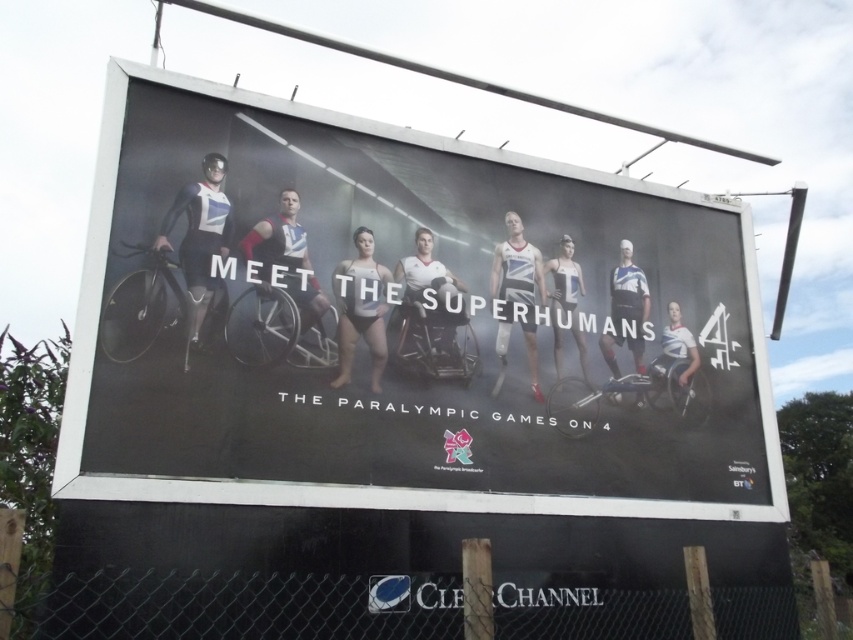
Question: Is matte black billboard at center above metal chain-link fence at lower center?

Choices:
 (A) yes
 (B) no

Answer: (A)

Question: Can you confirm if matte black billboard at center is positioned to the right of metal chain-link fence at lower center?

Choices:
 (A) no
 (B) yes

Answer: (B)

Question: Which point appears farthest from the camera in this image?

Choices:
 (A) (254, 593)
 (B) (221, 419)

Answer: (B)

Question: Does matte black billboard at center have a lesser width compared to metal chain-link fence at lower center?

Choices:
 (A) yes
 (B) no

Answer: (A)